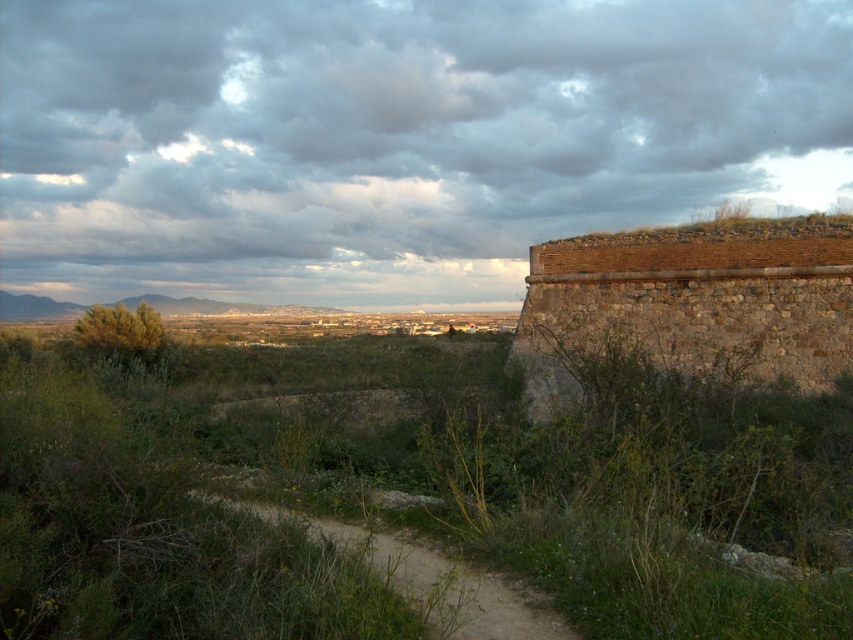
Consider the image. You are a hiker walking along the dirt path at center and want to reach the brown stone wall at right. Which direction should you head towards?

The brown stone wall at right is positioned on the right side of dirt path at center, so you should head towards the right direction to reach it.

You are a hiker trying to find the shortest path to the brown stone wall at right from the dirt path at center. Which direction should you head?

The brown stone wall at right has a larger size compared to dirt path at center, so you should head towards the direction of the larger structure to reach the brown stone wall at right.